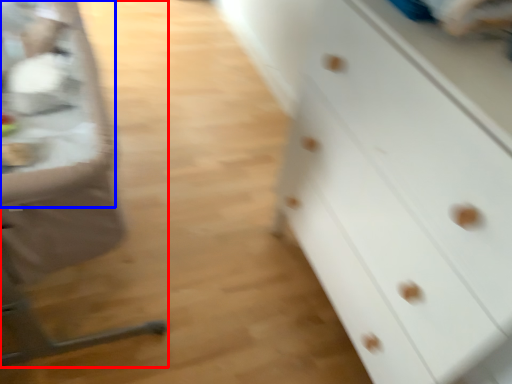
Question: Which object is further to the camera taking this photo, feeding chair (highlighted by a red box) or table (highlighted by a blue box)?

Choices:
 (A) feeding chair
 (B) table

Answer: (B)